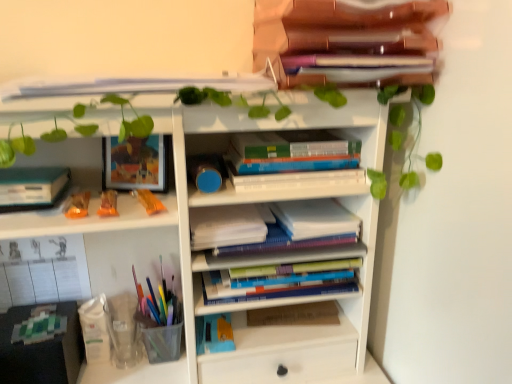
Find the location of `blank space situated above hardcover book at center, which appears as the first paperback book when ordered from the bottom (from a real-world perspective)`. blank space situated above hardcover book at center, which appears as the first paperback book when ordered from the bottom (from a real-world perspective) is located at coordinates (297, 310).